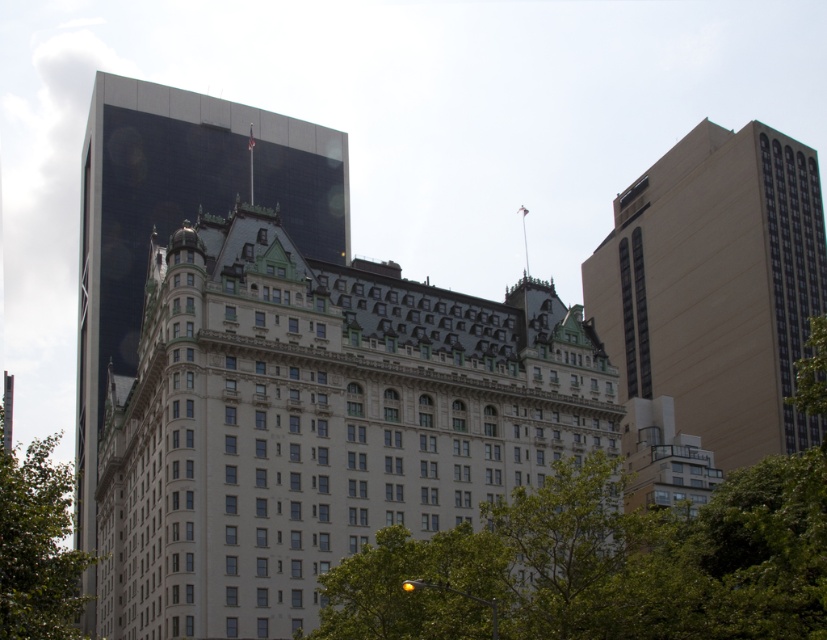
Which of these two, white stone building at center or green leafy tree at center, stands taller?

With more height is white stone building at center.

Consider the image. Does white stone building at center have a lesser height compared to green leafy tree at center?

No, white stone building at center is not shorter than green leafy tree at center.

Is point (106, 404) more distant than point (729, 518)?

Yes, point (106, 404) is farther from viewer.

Find the location of a particular element. The height and width of the screenshot is (640, 827). white stone building at center is located at coordinates (314, 422).

Consider the image. Is green leafy tree at center positioned before glassy reflective tower at upper left?

That is True.

Is green leafy tree at center to the right of glassy reflective tower at upper left from the viewer's perspective?

Indeed, green leafy tree at center is positioned on the right side of glassy reflective tower at upper left.

Measure the distance between green leafy tree at center and camera.

A distance of 34.64 meters exists between green leafy tree at center and camera.

Where is `green leafy tree at center`? The height and width of the screenshot is (640, 827). green leafy tree at center is located at coordinates (605, 563).

Does white stone building at center appear under glassy reflective tower at upper left?

Yes, white stone building at center is below glassy reflective tower at upper left.

Is point (213, 630) positioned behind point (84, 298)?

No, it is in front of (84, 298).

Who is more forward, (276, 602) or (199, 170)?

Point (276, 602) is in front.

Identify the location of white stone building at center. The width and height of the screenshot is (827, 640). pyautogui.click(x=314, y=422).